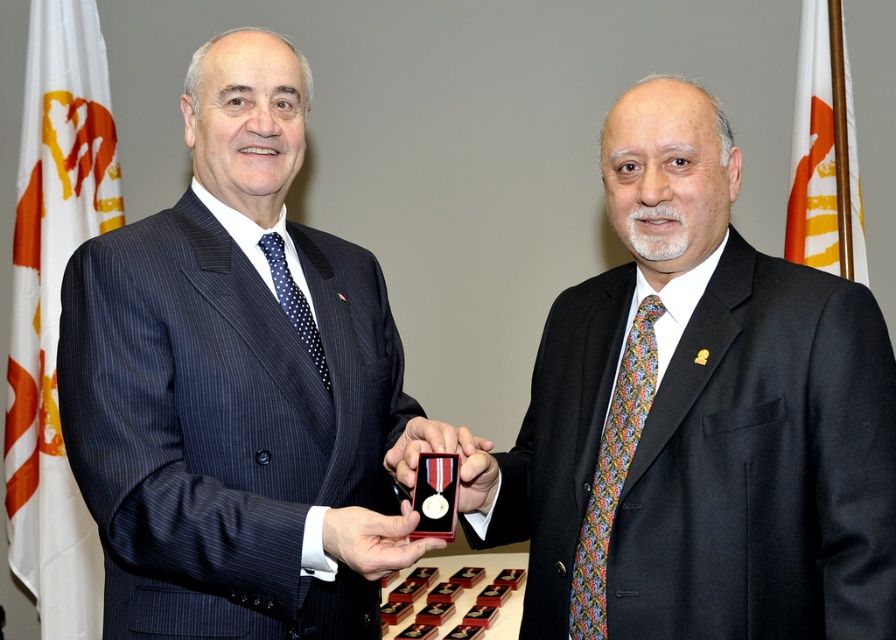
Does white fabric flag at upper right come behind metallic gold medal at center?

Yes.

How far apart are white fabric flag at upper right and metallic gold medal at center?

white fabric flag at upper right and metallic gold medal at center are 5.74 feet apart from each other.

The width and height of the screenshot is (896, 640). In order to click on white fabric flag at upper right in this screenshot , I will do `click(824, 152)`.

Is white fabric flag at left closer to camera compared to metallic gold medal at center?

No, white fabric flag at left is behind metallic gold medal at center.

Which is behind, point (42, 92) or point (405, 509)?

The point (42, 92) is more distant.

Is point (16, 330) positioned after point (418, 540)?

Yes.

The image size is (896, 640). What are the coordinates of `white fabric flag at left` in the screenshot? It's located at (55, 307).

Can you confirm if white fabric flag at upper right is wider than multicolored woven tie at right?

Yes.

Does point (845, 193) come closer to viewer compared to point (600, 596)?

No.

In order to click on white fabric flag at upper right in this screenshot , I will do `click(824, 152)`.